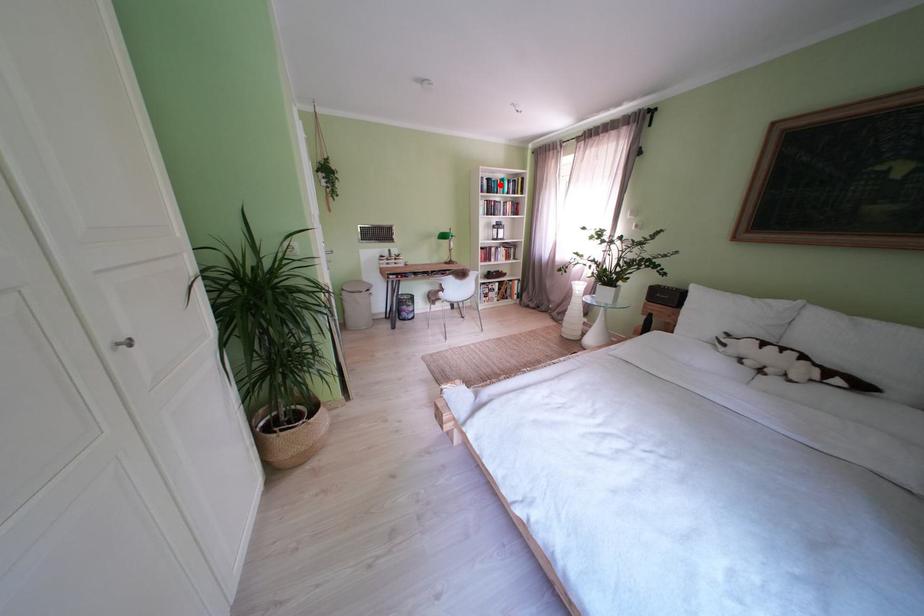
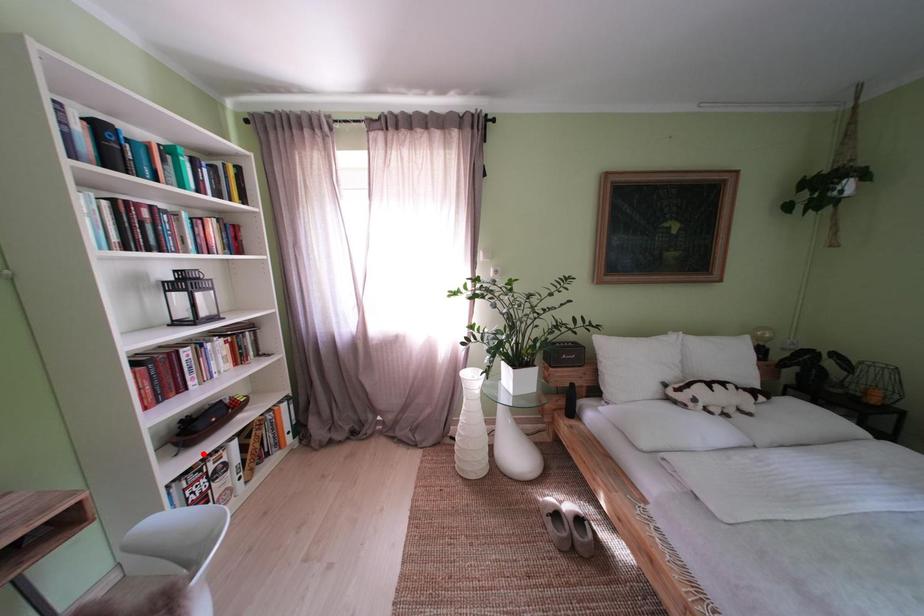
I am providing you with two images of the same scene from different viewpoints. A red point is marked on the first image and another point is marked on the second image. Does the point marked in image1 correspond to the same location as the one in image2?

No